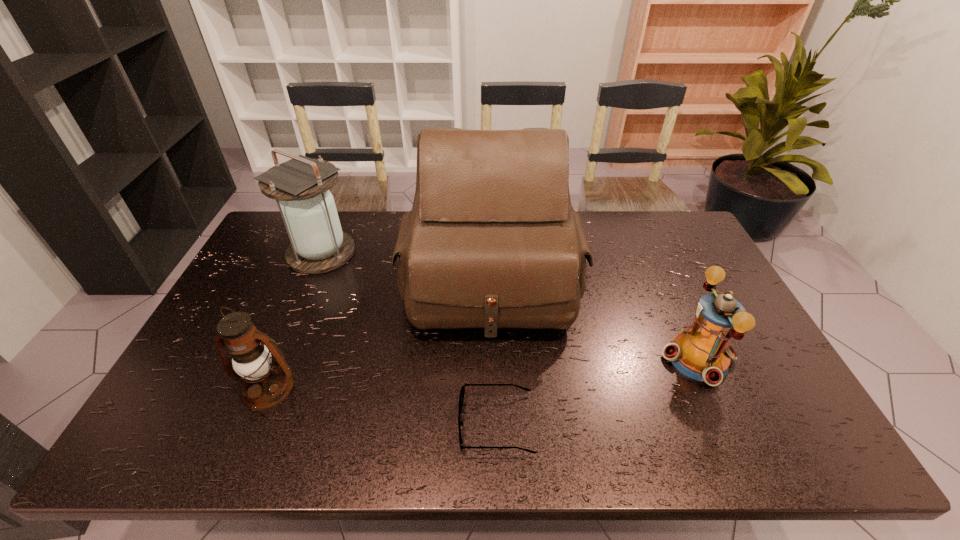
Where is `vacant space at the right edge`? vacant space at the right edge is located at coordinates (701, 256).

Identify the location of free spot between the shortest object and the rightmost lantern. This screenshot has width=960, height=540. (597, 390).

What are the coordinates of `free spot between the fourth shortest object and the shortest object` in the screenshot? It's located at (409, 338).

Identify the location of unoccupied position between the rightmost object and the tallest object. (594, 321).

The height and width of the screenshot is (540, 960). I want to click on vacant space in between the tallest object and the rightmost lantern, so click(x=594, y=321).

I want to click on vacant region between the tallest object and the shortest object, so click(x=493, y=354).

Select which object appears as the fourth closest to the spectacles. Please provide its 2D coordinates. Your answer should be formatted as a tuple, i.e. [(x, y)], where the tuple contains the x and y coordinates of a point satisfying the conditions above.

[(318, 245)]

Select which object appears as the second closest to the farthest lantern. Please provide its 2D coordinates. Your answer should be formatted as a tuple, i.e. [(x, y)], where the tuple contains the x and y coordinates of a point satisfying the conditions above.

[(266, 379)]

The width and height of the screenshot is (960, 540). Find the location of `lantern that is the closest to the tallest lantern`. lantern that is the closest to the tallest lantern is located at coordinates (266, 379).

I want to click on lantern that is the closest to the farthest lantern, so click(266, 379).